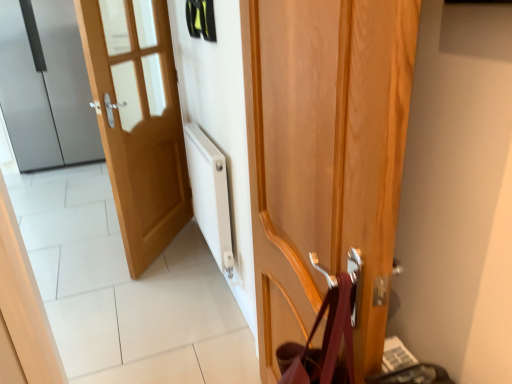
What do you see at coordinates (138, 125) in the screenshot? I see `light wood door at left, positioned as the 2th door in left-to-right order` at bounding box center [138, 125].

Describe the element at coordinates (46, 86) in the screenshot. I see `satin silver refrigerator at left, the first door when ordered from back to front` at that location.

This screenshot has height=384, width=512. What do you see at coordinates (325, 157) in the screenshot?
I see `wooden door at center, marked as the first door in a front-to-back arrangement` at bounding box center [325, 157].

Where is `light wood door at left, which appears as the 2th door when viewed from the back`? The width and height of the screenshot is (512, 384). light wood door at left, which appears as the 2th door when viewed from the back is located at coordinates (138, 125).

Is light wood door at left, which appears as the 2th door when viewed from the back, in front of or behind satin silver refrigerator at left, marked as the third door in a front-to-back arrangement, in the image?

In the image, light wood door at left, which appears as the 2th door when viewed from the back, appears in front of satin silver refrigerator at left, marked as the third door in a front-to-back arrangement.

Can we say light wood door at left, which appears as the second door when viewed from the front, lies outside satin silver refrigerator at left, marked as the third door in a front-to-back arrangement?

light wood door at left, which appears as the second door when viewed from the front, lies outside satin silver refrigerator at left, marked as the third door in a front-to-back arrangement,'s area.

Which of these two, light wood door at left, which appears as the 2th door when viewed from the back, or satin silver refrigerator at left, positioned as the 3th door in right-to-left order, stands shorter?

light wood door at left, which appears as the 2th door when viewed from the back.

From the image's perspective, is light wood door at left, the 2th door viewed from the right, above or below satin silver refrigerator at left, positioned as the 3th door in right-to-left order?

light wood door at left, the 2th door viewed from the right, is below satin silver refrigerator at left, positioned as the 3th door in right-to-left order.

From the image's perspective, is wooden door at center, which ranks as the 3th door in left-to-right order, positioned above or below light wood door at left, which appears as the 2th door when viewed from the back?

Based on their image positions, wooden door at center, which ranks as the 3th door in left-to-right order, is located beneath light wood door at left, which appears as the 2th door when viewed from the back.

How many degrees apart are the facing directions of wooden door at center, marked as the first door in a right-to-left arrangement, and light wood door at left, the 2th door viewed from the right?

There is a 36.4-degree angle between the facing directions of wooden door at center, marked as the first door in a right-to-left arrangement, and light wood door at left, the 2th door viewed from the right.

Are wooden door at center, marked as the first door in a right-to-left arrangement, and light wood door at left, the 2th door viewed from the right, making contact?

No, wooden door at center, marked as the first door in a right-to-left arrangement, is not next to light wood door at left, the 2th door viewed from the right.

Is point (375, 60) closer or farther from the camera than point (97, 45)?

Point (375, 60) is closer to the camera than point (97, 45).

Considering the relative sizes of satin silver refrigerator at left, marked as the third door in a front-to-back arrangement, and wooden door at center, arranged as the 3th door when viewed from the back, in the image provided, is satin silver refrigerator at left, marked as the third door in a front-to-back arrangement, shorter than wooden door at center, arranged as the 3th door when viewed from the back,?

In fact, satin silver refrigerator at left, marked as the third door in a front-to-back arrangement, may be taller than wooden door at center, arranged as the 3th door when viewed from the back.

Is satin silver refrigerator at left, positioned as the 3th door in right-to-left order, to the right of wooden door at center, marked as the first door in a right-to-left arrangement, from the viewer's perspective?

In fact, satin silver refrigerator at left, positioned as the 3th door in right-to-left order, is to the left of wooden door at center, marked as the first door in a right-to-left arrangement.

From a real-world perspective, is satin silver refrigerator at left, which is the 1th door from left to right, physically above wooden door at center, marked as the first door in a front-to-back arrangement?

Yes, from a real-world perspective, satin silver refrigerator at left, which is the 1th door from left to right, is on top of wooden door at center, marked as the first door in a front-to-back arrangement.

Do you think satin silver refrigerator at left, marked as the third door in a front-to-back arrangement, is within wooden door at center, marked as the first door in a front-to-back arrangement, or outside of it?

satin silver refrigerator at left, marked as the third door in a front-to-back arrangement, exists outside the volume of wooden door at center, marked as the first door in a front-to-back arrangement.

Is satin silver refrigerator at left, marked as the third door in a front-to-back arrangement, surrounded by wooden door at center, which ranks as the 3th door in left-to-right order?

No, satin silver refrigerator at left, marked as the third door in a front-to-back arrangement, is not surrounded by wooden door at center, which ranks as the 3th door in left-to-right order.

Between wooden door at center, marked as the first door in a right-to-left arrangement, and satin silver refrigerator at left, which is the 1th door from left to right, which one has larger width?

satin silver refrigerator at left, which is the 1th door from left to right, is wider.

From a real-world perspective, which is physically below, wooden door at center, arranged as the 3th door when viewed from the back, or satin silver refrigerator at left, the first door when ordered from back to front?

In real-world perspective, wooden door at center, arranged as the 3th door when viewed from the back, is lower.

Is satin silver refrigerator at left, positioned as the 3th door in right-to-left order, facing towards light wood door at left, which appears as the 2th door when viewed from the back?

Yes, satin silver refrigerator at left, positioned as the 3th door in right-to-left order, is aimed at light wood door at left, which appears as the 2th door when viewed from the back.

Which is in front, satin silver refrigerator at left, marked as the third door in a front-to-back arrangement, or light wood door at left, which appears as the 2th door when viewed from the back?

light wood door at left, which appears as the 2th door when viewed from the back, is closer to the camera.

Is satin silver refrigerator at left, marked as the third door in a front-to-back arrangement, to the right of light wood door at left, positioned as the 2th door in left-to-right order, from the viewer's perspective?

In fact, satin silver refrigerator at left, marked as the third door in a front-to-back arrangement, is to the left of light wood door at left, positioned as the 2th door in left-to-right order.

From the image's perspective, is satin silver refrigerator at left, positioned as the 3th door in right-to-left order, under light wood door at left, positioned as the 2th door in left-to-right order?

Incorrect, from the image's perspective, satin silver refrigerator at left, positioned as the 3th door in right-to-left order, is higher than light wood door at left, positioned as the 2th door in left-to-right order.

How far apart are light wood door at left, which appears as the 2th door when viewed from the back, and wooden door at center, marked as the first door in a right-to-left arrangement?

light wood door at left, which appears as the 2th door when viewed from the back, is 4.42 feet away from wooden door at center, marked as the first door in a right-to-left arrangement.

Does light wood door at left, which appears as the 2th door when viewed from the back, touch wooden door at center, marked as the first door in a front-to-back arrangement?

No, light wood door at left, which appears as the 2th door when viewed from the back, is not with wooden door at center, marked as the first door in a front-to-back arrangement.

From a real-world perspective, is light wood door at left, the 2th door viewed from the right, under wooden door at center, which ranks as the 3th door in left-to-right order?

No, from a real-world perspective, light wood door at left, the 2th door viewed from the right, is not beneath wooden door at center, which ranks as the 3th door in left-to-right order.

Is light wood door at left, which appears as the second door when viewed from the front, taller or shorter than wooden door at center, marked as the first door in a right-to-left arrangement?

Clearly, light wood door at left, which appears as the second door when viewed from the front, is taller compared to wooden door at center, marked as the first door in a right-to-left arrangement.

This screenshot has height=384, width=512. Identify the location of door positioned vertically above the light wood door at left, positioned as the 2th door in left-to-right order (from a real-world perspective). (46, 86).

You are a GUI agent. You are given a task and a screenshot of the screen. Output one action in this format:
    pyautogui.click(x=<x>, y=<y>)
    Task: Click on the door located underneath the light wood door at left, which appears as the 2th door when viewed from the back (from a real-world perspective)
    The image size is (512, 384).
    Given the screenshot: What is the action you would take?
    pyautogui.click(x=325, y=157)

Estimate the real-world distances between objects in this image. Which object is further from satin silver refrigerator at left, the first door when ordered from back to front, light wood door at left, positioned as the 2th door in left-to-right order, or wooden door at center, marked as the first door in a right-to-left arrangement?

wooden door at center, marked as the first door in a right-to-left arrangement, lies further to satin silver refrigerator at left, the first door when ordered from back to front, than the other object.

Looking at the image, which one is located further to wooden door at center, arranged as the 3th door when viewed from the back, satin silver refrigerator at left, positioned as the 3th door in right-to-left order, or light wood door at left, positioned as the 2th door in left-to-right order?

satin silver refrigerator at left, positioned as the 3th door in right-to-left order, is positioned further to the anchor wooden door at center, arranged as the 3th door when viewed from the back.

Looking at the image, which one is located closer to light wood door at left, positioned as the 2th door in left-to-right order, satin silver refrigerator at left, which is the 1th door from left to right, or wooden door at center, marked as the first door in a front-to-back arrangement?

Based on the image, wooden door at center, marked as the first door in a front-to-back arrangement, appears to be nearer to light wood door at left, positioned as the 2th door in left-to-right order.

Based on their spatial positions, is light wood door at left, which appears as the 2th door when viewed from the back, or satin silver refrigerator at left, positioned as the 3th door in right-to-left order, closer to wooden door at center, marked as the first door in a front-to-back arrangement?

The object closer to wooden door at center, marked as the first door in a front-to-back arrangement, is light wood door at left, which appears as the 2th door when viewed from the back.

From the image, which object appears to be nearer to light wood door at left, the 2th door viewed from the right, wooden door at center, marked as the first door in a right-to-left arrangement, or satin silver refrigerator at left, positioned as the 3th door in right-to-left order?

Based on the image, wooden door at center, marked as the first door in a right-to-left arrangement, appears to be nearer to light wood door at left, the 2th door viewed from the right.

Which object lies further to the anchor point satin silver refrigerator at left, the first door when ordered from back to front, wooden door at center, marked as the first door in a front-to-back arrangement, or light wood door at left, which appears as the 2th door when viewed from the back?

wooden door at center, marked as the first door in a front-to-back arrangement.

Where is `door positioned between wooden door at center, which ranks as the 3th door in left-to-right order, and satin silver refrigerator at left, which is the 1th door from left to right, from near to far`? door positioned between wooden door at center, which ranks as the 3th door in left-to-right order, and satin silver refrigerator at left, which is the 1th door from left to right, from near to far is located at coordinates (138, 125).